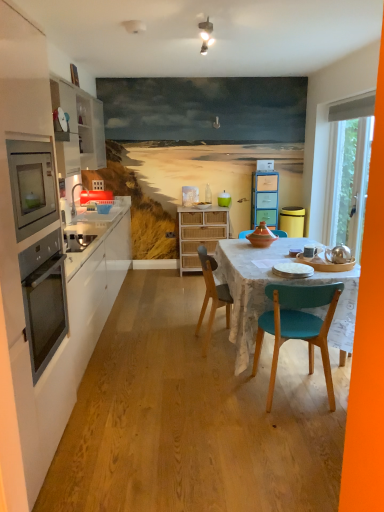
Image resolution: width=384 pixels, height=512 pixels. What are the coordinates of `free space above matte white plywood at center (from a real-world perspective)` in the screenshot? It's located at (182, 347).